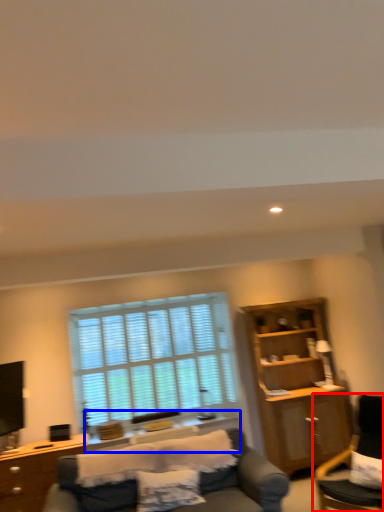
Question: Which point is closer to the camera, chair (highlighted by a red box) or side table (highlighted by a blue box)?

Choices:
 (A) chair
 (B) side table

Answer: (A)